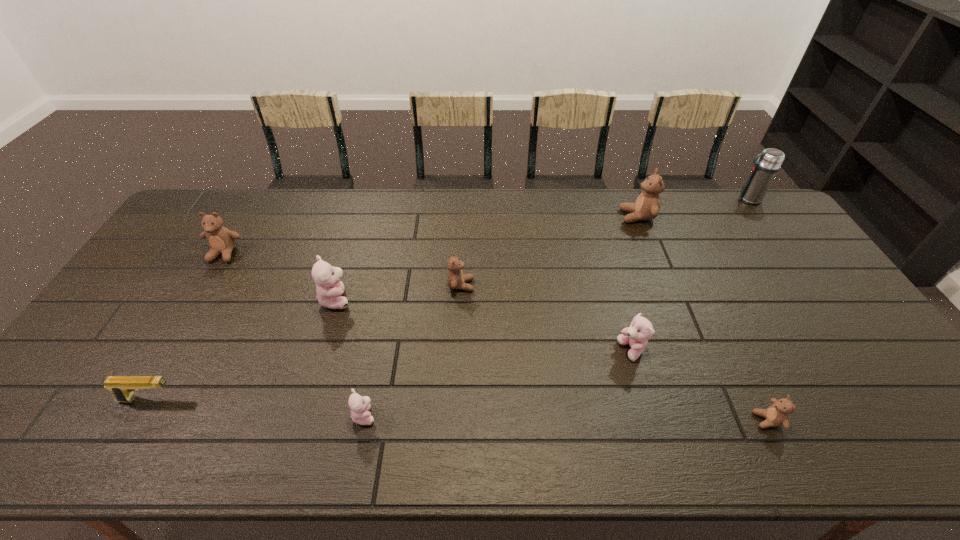
The height and width of the screenshot is (540, 960). What are the coordinates of `the second farthest pink teddy bear` in the screenshot? It's located at (641, 330).

Find the location of a particular element. The width and height of the screenshot is (960, 540). pistol is located at coordinates (123, 387).

Identify the location of tan pistol. (123, 387).

Identify the location of the rightmost brown teddy bear. (777, 414).

Identify the location of the second object from right to left. The image size is (960, 540). (777, 414).

Locate an element on the screen. This screenshot has width=960, height=540. the second pink teddy bear from left to right is located at coordinates (360, 406).

I want to click on the sixth object from right to left, so click(x=360, y=406).

Locate an element on the screen. vacant space located with a handle on the side of the thermos bottle is located at coordinates (646, 199).

At what (x,y) coordinates should I click in order to perform the action: click on blank area located with a handle on the side of the thermos bottle. Please return your answer as a coordinate pair (x, y). The image size is (960, 540). Looking at the image, I should click on pyautogui.click(x=635, y=199).

Identify the location of free space located with a handle on the side of the thermos bottle. This screenshot has width=960, height=540. (667, 199).